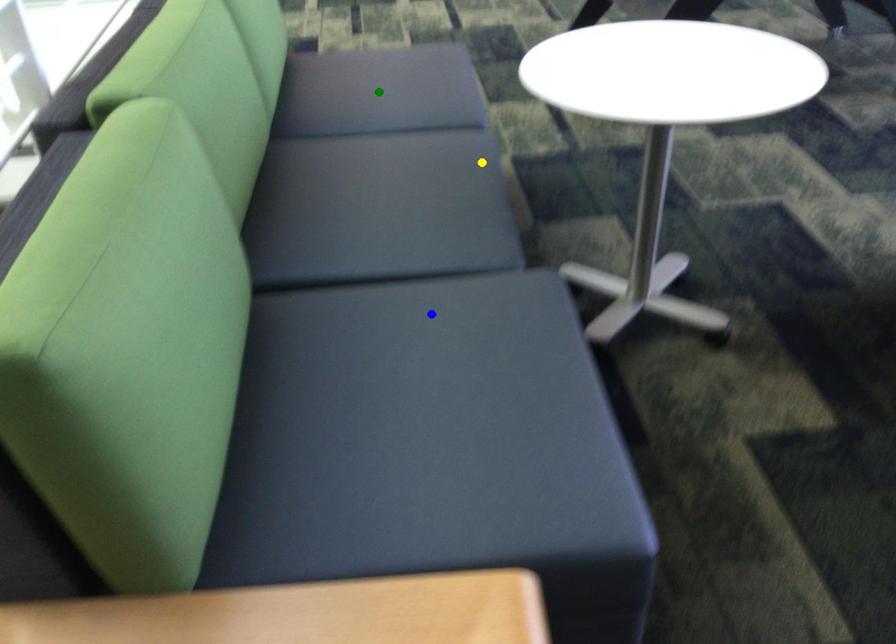
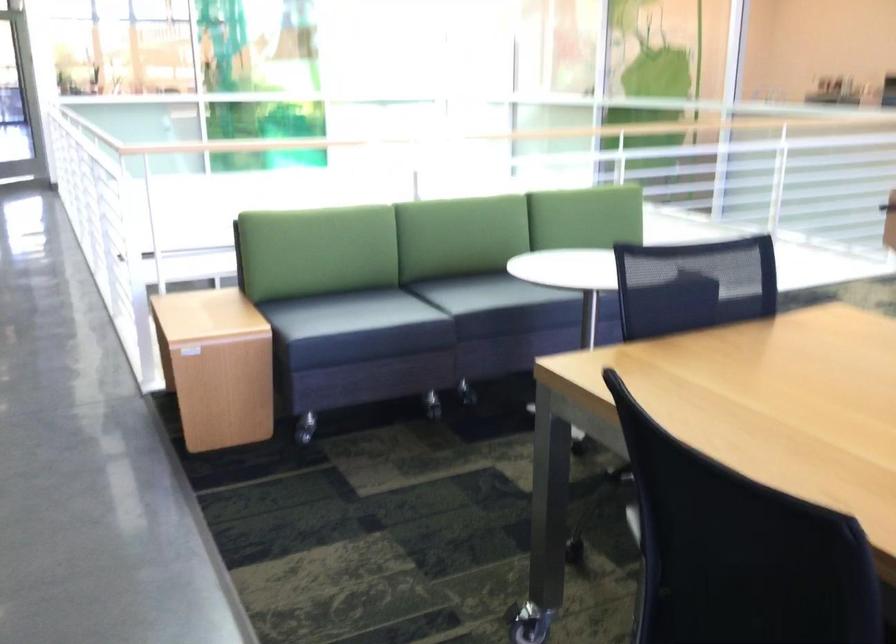
I am providing you with two images of the same scene from different viewpoints. Three points are marked in image1. Which point corresponds to a part or object that is occluded in image2?In image1, three points are marked. Which of them correspond to a part or object that is occluded in image2?Among the three points shown in image1, which one corresponds to a part or object that is no longer visible due to occlusion in image2?

green point cannot be seen in image2.